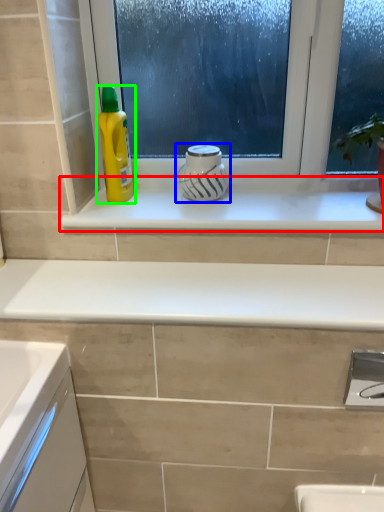
Question: Which object is the farthest from window sill (highlighted by a red box)? Choose among these: appliance (highlighted by a blue box) or cleaning product (highlighted by a green box).

Choices:
 (A) appliance
 (B) cleaning product

Answer: (B)